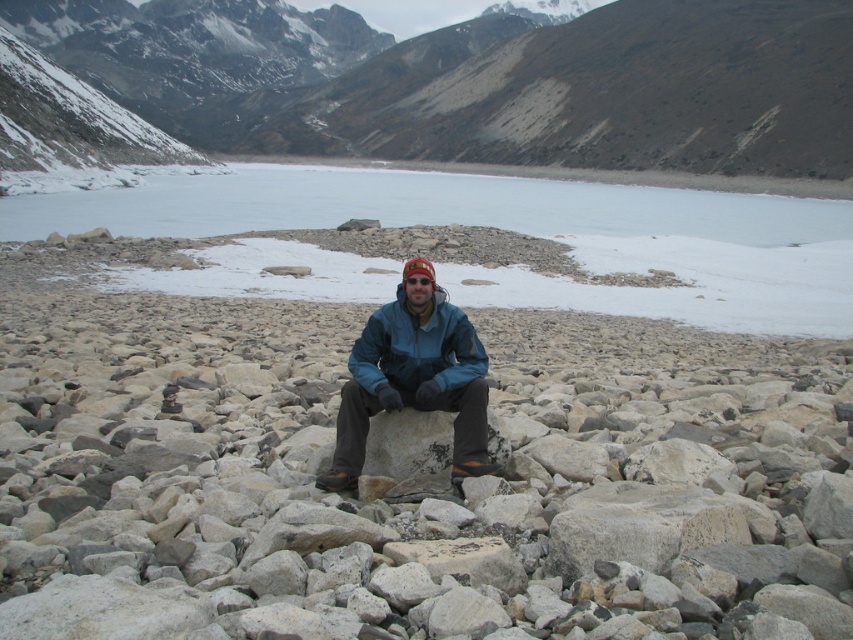
Image resolution: width=853 pixels, height=640 pixels. What do you see at coordinates (421, 205) in the screenshot?
I see `white ice at upper center` at bounding box center [421, 205].

Between point (538, 227) and point (425, 308), which one is positioned in front?

Point (425, 308) is in front.

Identify the location of white ice at upper center. (421, 205).

Find the location of a particular element. brown rocky mountain at upper center is located at coordinates (479, 81).

Is the position of brown rocky mountain at upper center more distant than that of white ice at upper center?

That is True.

Where is `brown rocky mountain at upper center`? This screenshot has width=853, height=640. brown rocky mountain at upper center is located at coordinates (479, 81).

Identify the location of brown rocky mountain at upper center. (479, 81).

Does blue fabric jacket at center appear on the right side of blue matte jacket at center?

Incorrect, blue fabric jacket at center is not on the right side of blue matte jacket at center.

Is point (321, 477) closer to viewer compared to point (369, 346)?

Yes, point (321, 477) is in front of point (369, 346).

Identify the location of blue fabric jacket at center. The height and width of the screenshot is (640, 853). (415, 378).